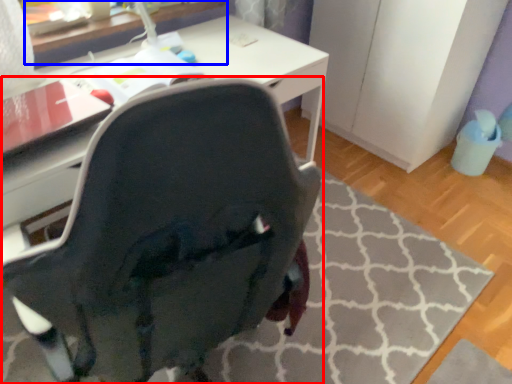
Question: Among these objects, which one is nearest to the camera, chair (highlighted by a red box) or table (highlighted by a blue box)?

Choices:
 (A) chair
 (B) table

Answer: (A)